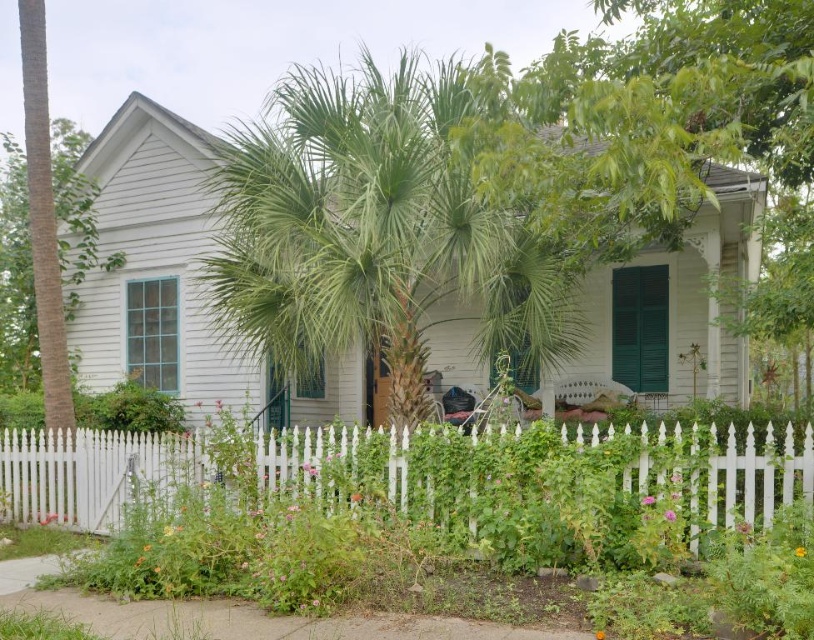
Is point (712, 509) farther from viewer compared to point (620, 272)?

That is False.

Is white picket fence at lower center smaller than green matte shutters at lower right?

Yes, white picket fence at lower center is smaller than green matte shutters at lower right.

Where is `white picket fence at lower center`? This screenshot has width=814, height=640. white picket fence at lower center is located at coordinates (93, 474).

Find the location of a particular element. The height and width of the screenshot is (640, 814). white picket fence at lower center is located at coordinates (93, 474).

Between white picket fence at lower center and green matte window at center, which one is positioned higher?

green matte window at center

Which of these two, white picket fence at lower center or green matte window at center, stands taller?

Standing taller between the two is green matte window at center.

Describe the element at coordinates (93, 474) in the screenshot. I see `white picket fence at lower center` at that location.

This screenshot has width=814, height=640. I want to click on white picket fence at lower center, so click(93, 474).

Does green matte shutters at lower right appear over green matte window at center?

Correct, green matte shutters at lower right is located above green matte window at center.

Is point (654, 288) positioned in front of point (142, 282)?

That is True.

Describe the element at coordinates (640, 326) in the screenshot. I see `green matte shutters at lower right` at that location.

Where is `green matte shutters at lower right`? The image size is (814, 640). green matte shutters at lower right is located at coordinates (640, 326).